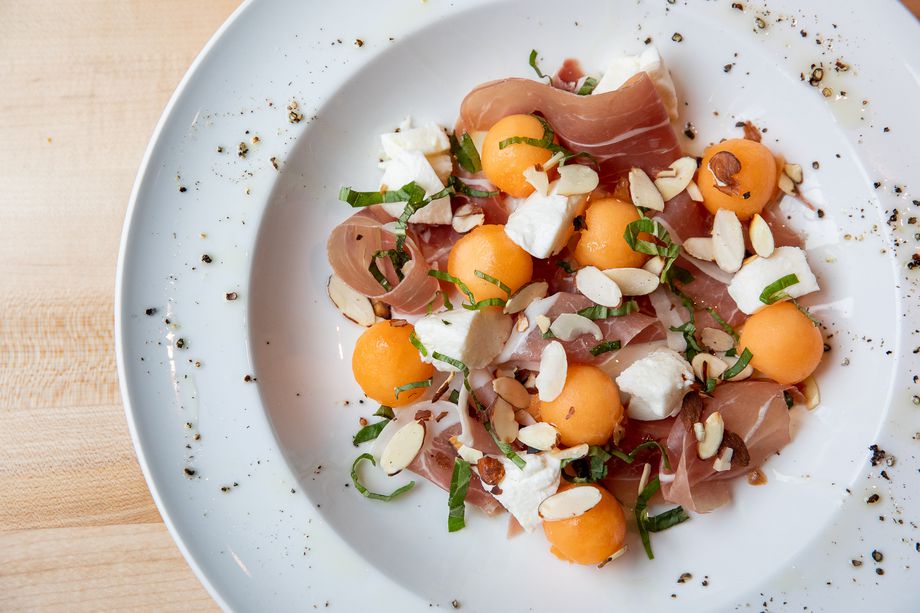
The width and height of the screenshot is (920, 613). I want to click on plate, so click(x=872, y=166).